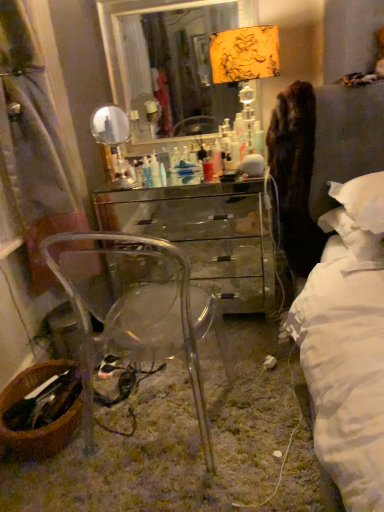
Question: Can you confirm if metallic silver mirror at upper center is smaller than transparent acrylic chair at center?

Choices:
 (A) no
 (B) yes

Answer: (B)

Question: Can you confirm if metallic silver mirror at upper center is positioned to the left of transparent acrylic chair at center?

Choices:
 (A) no
 (B) yes

Answer: (A)

Question: Does metallic silver mirror at upper center have a greater width compared to transparent acrylic chair at center?

Choices:
 (A) no
 (B) yes

Answer: (A)

Question: From a real-world perspective, does metallic silver mirror at upper center stand above transparent acrylic chair at center?

Choices:
 (A) yes
 (B) no

Answer: (A)

Question: Does metallic silver mirror at upper center come in front of transparent acrylic chair at center?

Choices:
 (A) no
 (B) yes

Answer: (A)

Question: Is metallic silver mirror at upper center outside transparent acrylic chair at center?

Choices:
 (A) yes
 (B) no

Answer: (A)

Question: Is glossy mirrored chest of drawers at center oriented away from metallic silver mirror at upper center?

Choices:
 (A) yes
 (B) no

Answer: (B)

Question: Considering the relative positions of glossy mirrored chest of drawers at center and metallic silver mirror at upper center in the image provided, is glossy mirrored chest of drawers at center behind metallic silver mirror at upper center?

Choices:
 (A) no
 (B) yes

Answer: (A)

Question: Does glossy mirrored chest of drawers at center have a lesser height compared to metallic silver mirror at upper center?

Choices:
 (A) yes
 (B) no

Answer: (B)

Question: Could you tell me if glossy mirrored chest of drawers at center is turned towards metallic silver mirror at upper center?

Choices:
 (A) no
 (B) yes

Answer: (A)

Question: Is metallic silver mirror at upper center inside glossy mirrored chest of drawers at center?

Choices:
 (A) no
 (B) yes

Answer: (A)

Question: From the image's perspective, is glossy mirrored chest of drawers at center on top of metallic silver mirror at upper center?

Choices:
 (A) yes
 (B) no

Answer: (B)

Question: Considering the relative sizes of transparent acrylic chair at center and translucent plastic container at center in the image provided, is transparent acrylic chair at center shorter than translucent plastic container at center?

Choices:
 (A) yes
 (B) no

Answer: (B)